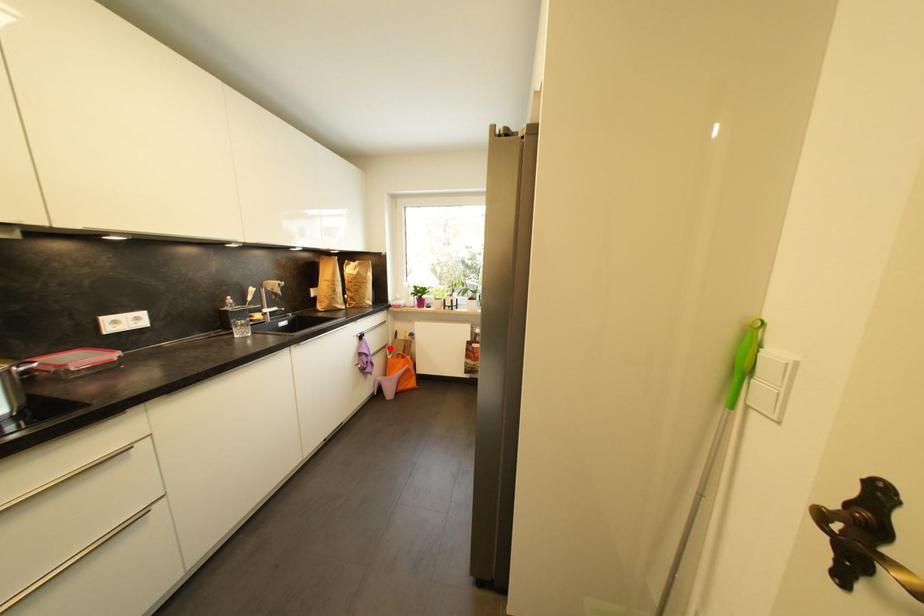
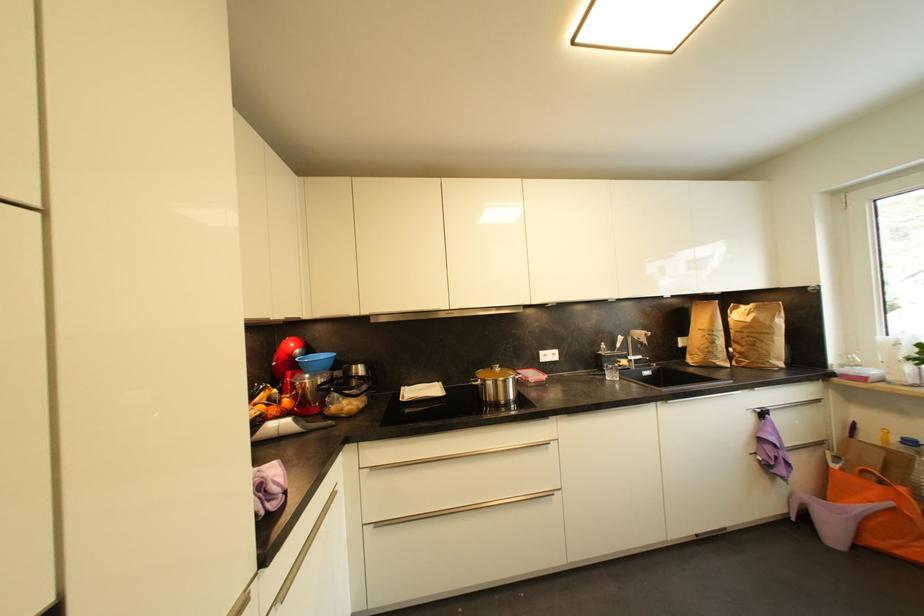
Question: I am providing you with two images of the same scene from different viewpoints. Image1 has a red point marked. In image2, the corresponding 3D location appears at what relative position? Reply with the corresponding letter.

Choices:
 (A) Closer
 (B) Farther

Answer: (A)